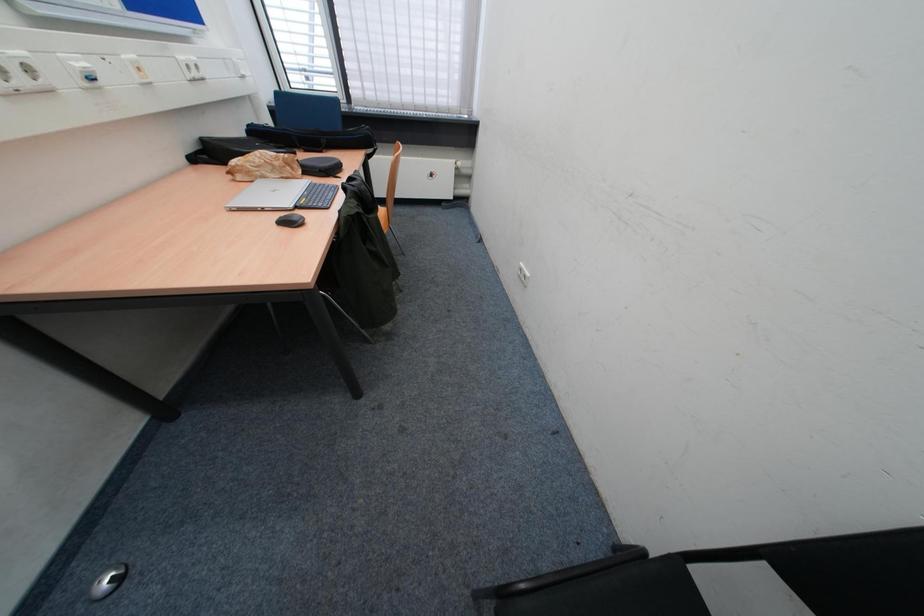
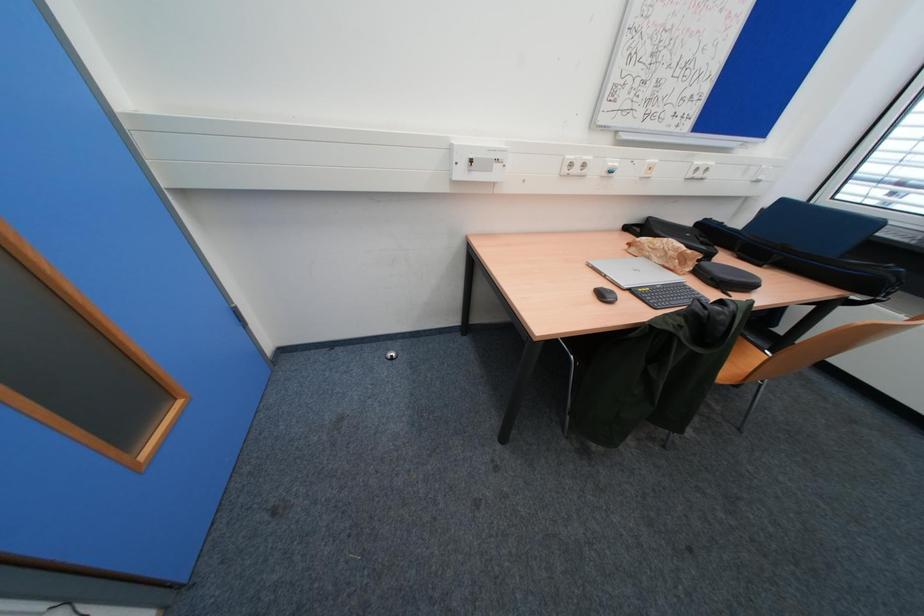
First-person continuous shooting, in which direction is the camera rotating?

The camera rotated toward left-down.